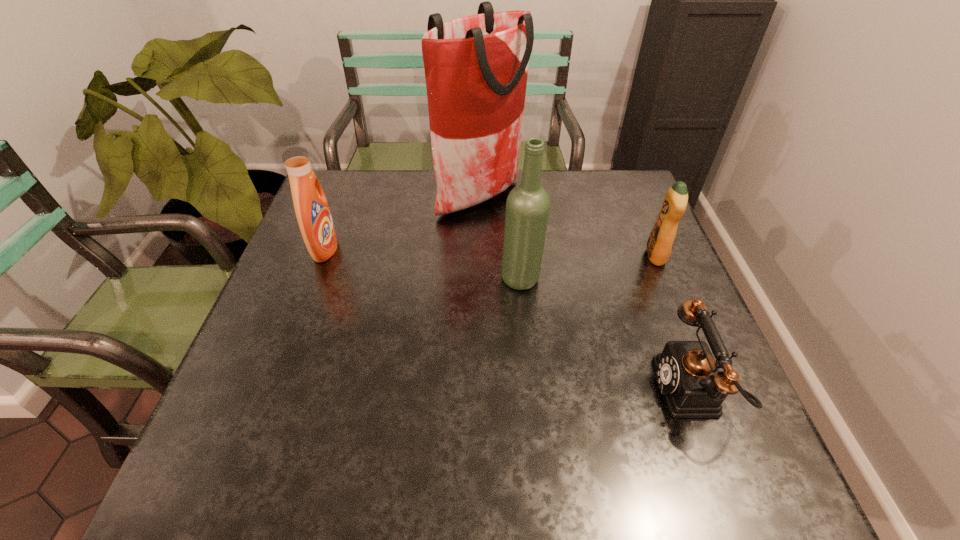
Locate an element on the screen. The image size is (960, 540). vacant space that's between the nearest object and the second tallest object is located at coordinates coord(607,335).

The image size is (960, 540). Find the location of `unoccupied position between the shorter detergent and the grocery bag`. unoccupied position between the shorter detergent and the grocery bag is located at coordinates coord(568,226).

Locate an element on the screen. Image resolution: width=960 pixels, height=540 pixels. vacant space that is in between the farthest object and the leftmost object is located at coordinates (402, 223).

Where is `vacant area between the shortest object and the farthest object`? This screenshot has width=960, height=540. vacant area between the shortest object and the farthest object is located at coordinates (587, 293).

Where is `free space between the wine bottle and the farthest object`? The height and width of the screenshot is (540, 960). free space between the wine bottle and the farthest object is located at coordinates (500, 238).

Identify the location of vacant space that is in between the farthest object and the shorter detergent. (568, 226).

Where is `free point between the third shortest object and the farthest object`? free point between the third shortest object and the farthest object is located at coordinates (402, 223).

Image resolution: width=960 pixels, height=540 pixels. Identify the location of free spot between the wine bottle and the grocery bag. (500, 238).

You are a GUI agent. You are given a task and a screenshot of the screen. Output one action in this format:
    pyautogui.click(x=<x>, y=<y>)
    Task: Click on the object identified as the third closest to the left detergent
    
    Given the screenshot: What is the action you would take?
    pyautogui.click(x=689, y=377)

Identify which object is the third nearest to the nearest object. Please provide its 2D coordinates. Your answer should be formatted as a tuple, i.e. [(x, y)], where the tuple contains the x and y coordinates of a point satisfying the conditions above.

[(476, 67)]